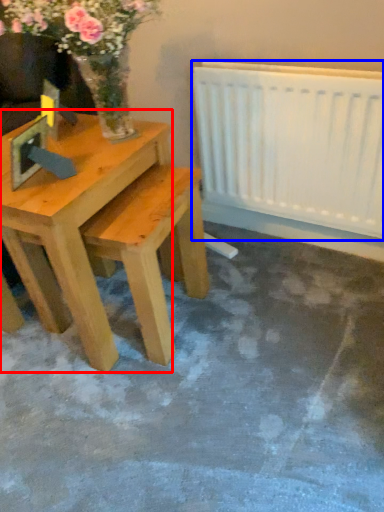
Question: Which point is closer to the camera, table (highlighted by a red box) or radiator (highlighted by a blue box)?

Choices:
 (A) table
 (B) radiator

Answer: (A)